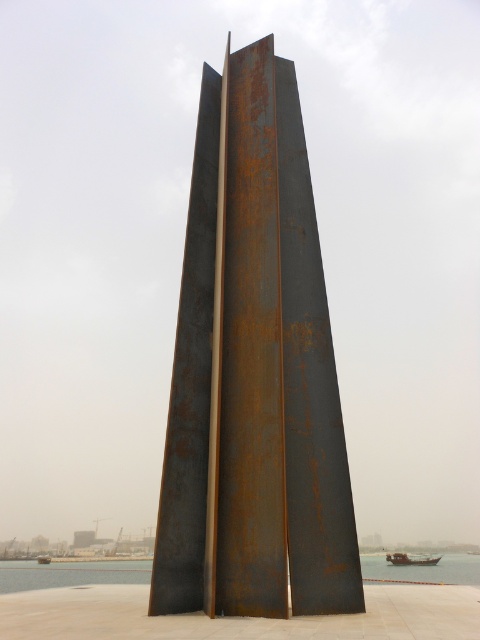
Is clear water at center to the right of rusty metal boat at lower right from the viewer's perspective?

In fact, clear water at center is to the left of rusty metal boat at lower right.

Is clear water at center shorter than rusty metal boat at lower right?

No, clear water at center is not shorter than rusty metal boat at lower right.

The width and height of the screenshot is (480, 640). I want to click on clear water at center, so click(x=70, y=573).

Is rusty metal sculpture at center below rusty metal boat at lower left?

Actually, rusty metal sculpture at center is above rusty metal boat at lower left.

Which is in front, point (218, 289) or point (48, 557)?

Point (218, 289) is more forward.

Does point (300, 608) come farther from viewer compared to point (45, 557)?

No, it is in front of (45, 557).

The height and width of the screenshot is (640, 480). Identify the location of rusty metal sculpture at center. (253, 372).

The height and width of the screenshot is (640, 480). What do you see at coordinates (253, 372) in the screenshot?
I see `rusty metal sculpture at center` at bounding box center [253, 372].

Is rusty metal sculpture at center to the right of clear water at center from the viewer's perspective?

Incorrect, rusty metal sculpture at center is not on the right side of clear water at center.

What do you see at coordinates (253, 372) in the screenshot?
I see `rusty metal sculpture at center` at bounding box center [253, 372].

Identify the location of rusty metal sculpture at center. (253, 372).